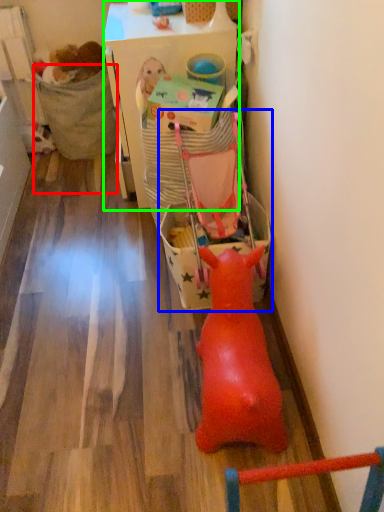
Question: Estimate the real-world distances between objects in this image. Which object is closer to chair (highlighted by a red box), baby carriage (highlighted by a blue box) or table (highlighted by a green box)?

Choices:
 (A) baby carriage
 (B) table

Answer: (B)